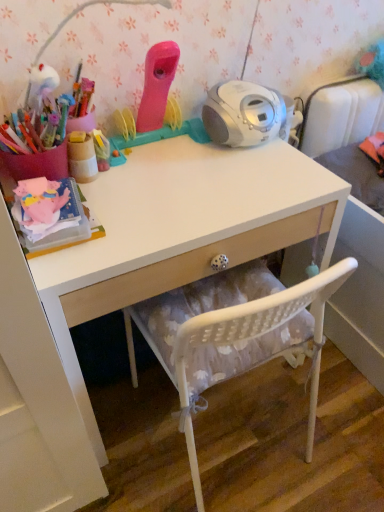
Question: Is the position of white glossy desk at center more distant than that of white mesh chair at lower center?

Choices:
 (A) no
 (B) yes

Answer: (A)

Question: Could white mesh chair at lower center be considered to be inside white glossy desk at center?

Choices:
 (A) yes
 (B) no

Answer: (B)

Question: Does white glossy desk at center have a larger size compared to white mesh chair at lower center?

Choices:
 (A) yes
 (B) no

Answer: (A)

Question: From a real-world perspective, is white glossy desk at center below white mesh chair at lower center?

Choices:
 (A) yes
 (B) no

Answer: (B)

Question: Does white glossy desk at center have a greater width compared to white mesh chair at lower center?

Choices:
 (A) no
 (B) yes

Answer: (A)

Question: From the image's perspective, is white glossy desk at center on top of white mesh chair at lower center?

Choices:
 (A) no
 (B) yes

Answer: (B)

Question: Does white mesh chair at lower center have a smaller size compared to white glossy desk at center?

Choices:
 (A) yes
 (B) no

Answer: (A)

Question: Can you confirm if white mesh chair at lower center is positioned to the right of white glossy desk at center?

Choices:
 (A) no
 (B) yes

Answer: (B)

Question: Is white mesh chair at lower center thinner than white glossy desk at center?

Choices:
 (A) yes
 (B) no

Answer: (B)

Question: Are white mesh chair at lower center and white glossy desk at center far apart?

Choices:
 (A) yes
 (B) no

Answer: (B)

Question: Does white mesh chair at lower center have a lesser height compared to white glossy desk at center?

Choices:
 (A) no
 (B) yes

Answer: (B)

Question: From a real-world perspective, is white mesh chair at lower center beneath white glossy desk at center?

Choices:
 (A) no
 (B) yes

Answer: (B)

Question: Is white mesh chair at lower center thinner than wooden cup at upper left?

Choices:
 (A) no
 (B) yes

Answer: (A)